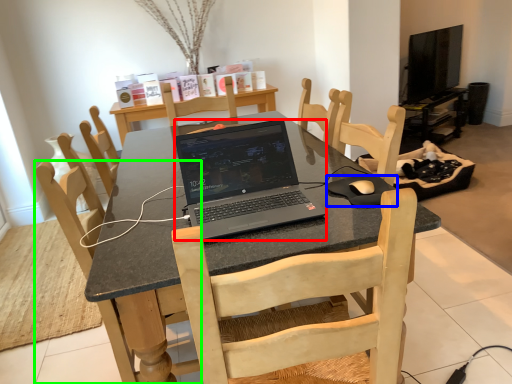
Question: Which is nearer to the laptop (highlighted by a red box)? mousepad (highlighted by a blue box) or chair (highlighted by a green box).

Choices:
 (A) mousepad
 (B) chair

Answer: (A)